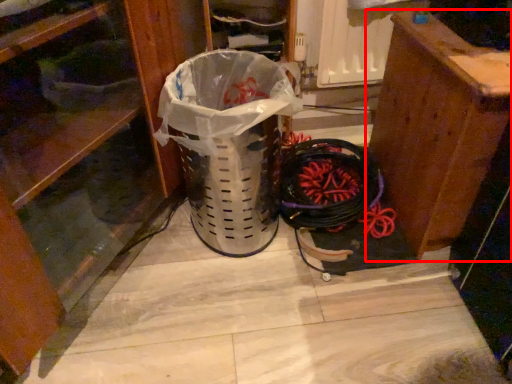
Question: From the image's perspective, what is the correct spatial relationship of furniture (annotated by the red box) in relation to dresser?

Choices:
 (A) above
 (B) below

Answer: (B)